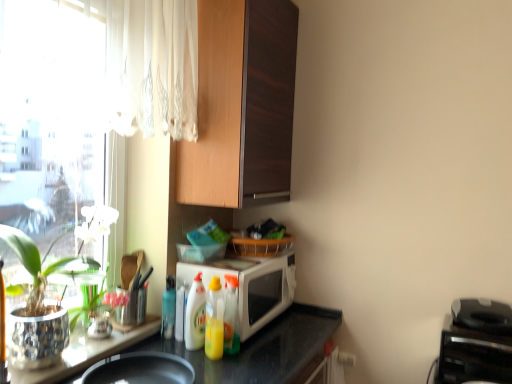
Question: In terms of width, does wooden cabinet at upper center look wider or thinner when compared to translucent plastic bottle at center, marked as the 4th bottle in a right-to-left arrangement?

Choices:
 (A) thin
 (B) wide

Answer: (B)

Question: Based on their positions, is wooden cabinet at upper center located to the left or right of translucent plastic bottle at center, which is the 1th bottle from left to right?

Choices:
 (A) right
 (B) left

Answer: (A)

Question: Estimate the real-world distances between objects in this image. Which object is closer to the metallic silver table at lower left?

Choices:
 (A) yellow translucent bottle at center, the second bottle in the right-to-left sequence
 (B) shiny metallic pot at left
 (C) white glossy microwave at center
 (D) white glossy bottle at center, the third bottle in the right-to-left sequence
 (E) wooden cabinet at upper center

Answer: (B)

Question: Which object is positioned closest to the translucent plastic bottle at center, which is the 1th bottle from left to right?

Choices:
 (A) white glossy microwave at center
 (B) yellow translucent bottle at center, which appears as the 3th bottle when viewed from the left
 (C) metallic silver table at lower left
 (D) white glossy bottle at center, which is the 2th bottle from left to right
 (E) translucent plastic bottle at center, positioned as the 4th bottle in left-to-right order

Answer: (D)